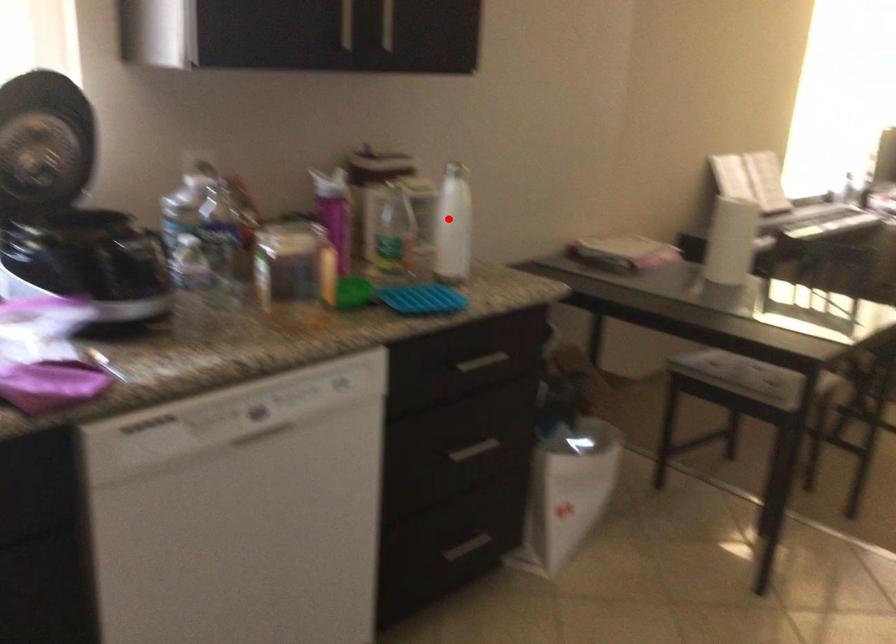
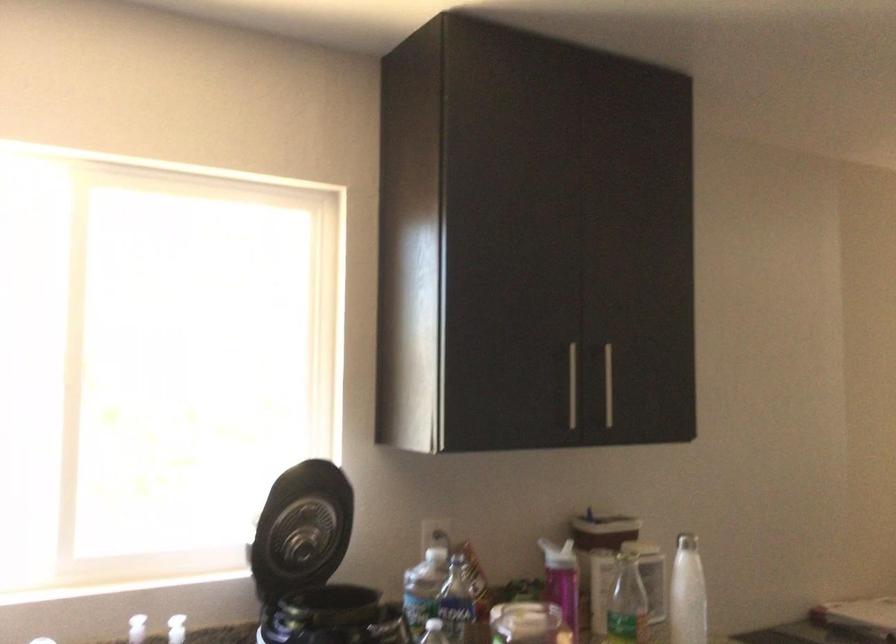
The point at the highlighted location is marked in the first image. Where is the corresponding point in the second image?

(687, 592)